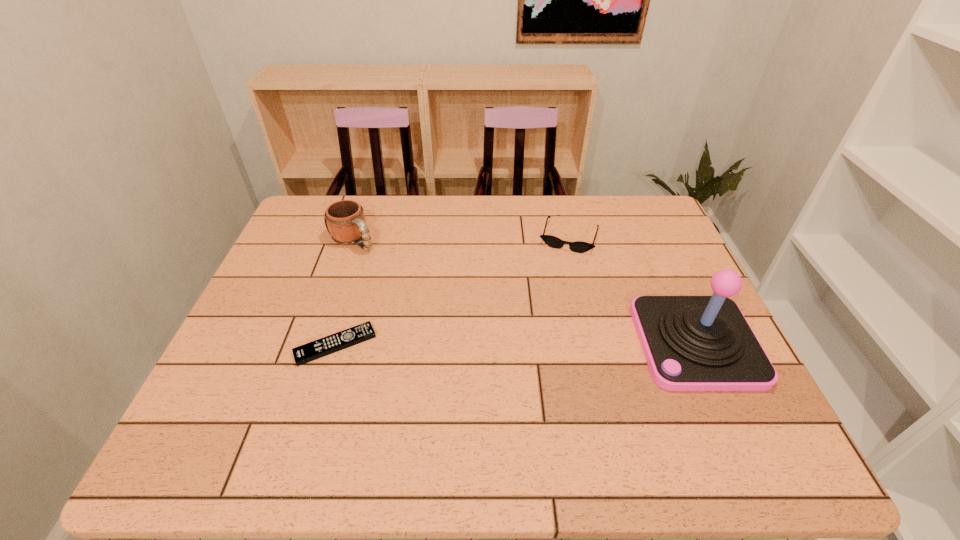
At what (x,y) coordinates should I click in order to perform the action: click on free space on the desktop that is between the remote control and the tallest object and is positioned on the side of the second tallest object with the handle. Please return your answer as a coordinate pair (x, y). The image size is (960, 540). Looking at the image, I should click on (482, 344).

At what (x,y) coordinates should I click in order to perform the action: click on free space on the desktop that is between the remote control and the rightmost object and is positioned on the front-facing side of the third object from left to right. Please return your answer as a coordinate pair (x, y). This screenshot has height=540, width=960. Looking at the image, I should click on (538, 343).